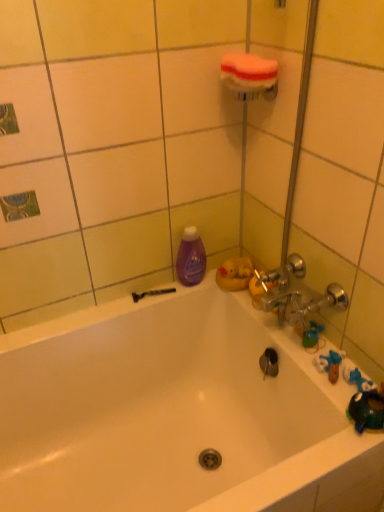
The height and width of the screenshot is (512, 384). I want to click on free spot to the left of green rubber toy at right, so click(280, 334).